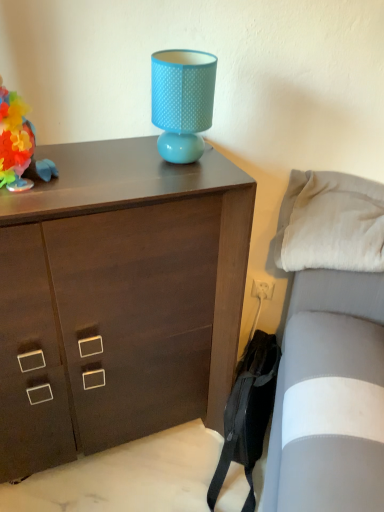
Where is `matte blue lampshade at upper center`? This screenshot has width=384, height=512. matte blue lampshade at upper center is located at coordinates (182, 101).

What are the coordinates of `multicolored paper flower at left` in the screenshot? It's located at (19, 144).

What do you see at coordinates (19, 144) in the screenshot? I see `multicolored paper flower at left` at bounding box center [19, 144].

This screenshot has height=512, width=384. Find the location of `matte blue lampshade at upper center`. matte blue lampshade at upper center is located at coordinates (182, 101).

Locate an element on the screen. The height and width of the screenshot is (512, 384). table lamp in front of the white soft pillow at right is located at coordinates (182, 101).

From a real-world perspective, is matte blue lampshade at upper center positioned above or below white soft pillow at right?

In terms of real-world spatial position, matte blue lampshade at upper center is above white soft pillow at right.

Is matte blue lampshade at upper center behind white soft pillow at right?

That is False.

Considering the positions of objects matte blue lampshade at upper center and white soft pillow at right in the image provided, who is more to the left, matte blue lampshade at upper center or white soft pillow at right?

From the viewer's perspective, matte blue lampshade at upper center appears more on the left side.

Is matte blue lampshade at upper center far away from dark wood chest of drawers at upper center?

Actually, matte blue lampshade at upper center and dark wood chest of drawers at upper center are a little close together.

How many degrees apart are the facing directions of matte blue lampshade at upper center and dark wood chest of drawers at upper center?

The angle between the facing direction of matte blue lampshade at upper center and the facing direction of dark wood chest of drawers at upper center is 2.59 degrees.

Identify the location of table lamp located above the dark wood chest of drawers at upper center (from the image's perspective). (182, 101).

Is matte blue lampshade at upper center taller or shorter than dark wood chest of drawers at upper center?

matte blue lampshade at upper center is shorter than dark wood chest of drawers at upper center.

Is dark wood chest of drawers at upper center facing away from multicolored paper flower at left?

That's not correct — dark wood chest of drawers at upper center is not looking away from multicolored paper flower at left.

From the image's perspective, is dark wood chest of drawers at upper center located above or below multicolored paper flower at left?

dark wood chest of drawers at upper center is below multicolored paper flower at left.

From the picture: How distant is dark wood chest of drawers at upper center from multicolored paper flower at left?

44.23 centimeters.

Considering the sizes of objects dark wood chest of drawers at upper center and multicolored paper flower at left in the image provided, who is wider, dark wood chest of drawers at upper center or multicolored paper flower at left?

dark wood chest of drawers at upper center.

Which object is closer to the camera taking this photo, white soft pillow at right or multicolored paper flower at left?

multicolored paper flower at left is more forward.

From a real-world perspective, is white soft pillow at right on multicolored paper flower at left?

No, from a real-world perspective, white soft pillow at right is not over multicolored paper flower at left

Considering the positions of point (306, 203) and point (22, 185), is point (306, 203) closer or farther from the camera than point (22, 185)?

Point (306, 203) is farther from the camera than point (22, 185).

I want to click on toy in front of the white soft pillow at right, so point(19,144).

Who is smaller, white soft pillow at right or matte blue lampshade at upper center?

→ matte blue lampshade at upper center is smaller.

Is white soft pillow at right oriented away from matte blue lampshade at upper center?

No, matte blue lampshade at upper center is not at the back of white soft pillow at right.

Is white soft pillow at right far away from matte blue lampshade at upper center?

No, white soft pillow at right is not far from matte blue lampshade at upper center.

From the image's perspective, is multicolored paper flower at left on top of matte blue lampshade at upper center?

No, from the image's perspective, multicolored paper flower at left is not above matte blue lampshade at upper center.

Is there a large distance between multicolored paper flower at left and matte blue lampshade at upper center?

No, multicolored paper flower at left is in close proximity to matte blue lampshade at upper center.

From a real-world perspective, is multicolored paper flower at left located higher than matte blue lampshade at upper center?

Correct, in the physical world, multicolored paper flower at left is higher than matte blue lampshade at upper center.

Locate an element on the screen. table lamp on the right side of multicolored paper flower at left is located at coordinates (182, 101).

Between dark wood chest of drawers at upper center and white soft pillow at right, which one appears on the right side from the viewer's perspective?

From the viewer's perspective, white soft pillow at right appears more on the right side.

From the image's perspective, is dark wood chest of drawers at upper center above white soft pillow at right?

Actually, dark wood chest of drawers at upper center appears below white soft pillow at right in the image.

Looking at their sizes, would you say dark wood chest of drawers at upper center is wider or thinner than white soft pillow at right?

Clearly, dark wood chest of drawers at upper center has more width compared to white soft pillow at right.

At what (x,y) coordinates should I click in order to perform the action: click on table lamp lying on the left of white soft pillow at right. Please return your answer as a coordinate pair (x, y). Looking at the image, I should click on (182, 101).

Identify the location of table lamp above the dark wood chest of drawers at upper center (from the image's perspective). (182, 101).

Considering their positions, is multicolored paper flower at left positioned further to matte blue lampshade at upper center than white soft pillow at right?

white soft pillow at right is further to matte blue lampshade at upper center.

Considering their positions, is multicolored paper flower at left positioned further to white soft pillow at right than dark wood chest of drawers at upper center?

multicolored paper flower at left is further to white soft pillow at right.

Considering their positions, is dark wood chest of drawers at upper center positioned closer to matte blue lampshade at upper center than multicolored paper flower at left?

The object closer to matte blue lampshade at upper center is multicolored paper flower at left.

Estimate the real-world distances between objects in this image. Which object is closer to dark wood chest of drawers at upper center, matte blue lampshade at upper center or multicolored paper flower at left?

matte blue lampshade at upper center lies closer to dark wood chest of drawers at upper center than the other object.

Estimate the real-world distances between objects in this image. Which object is further from white soft pillow at right, dark wood chest of drawers at upper center or matte blue lampshade at upper center?

dark wood chest of drawers at upper center is further to white soft pillow at right.

From the picture: Which object lies further to the anchor point multicolored paper flower at left, dark wood chest of drawers at upper center or white soft pillow at right?

The object further to multicolored paper flower at left is white soft pillow at right.

Estimate the real-world distances between objects in this image. Which object is further from multicolored paper flower at left, white soft pillow at right or matte blue lampshade at upper center?

white soft pillow at right lies further to multicolored paper flower at left than the other object.

Looking at the image, which one is located further to dark wood chest of drawers at upper center, multicolored paper flower at left or matte blue lampshade at upper center?

multicolored paper flower at left.

Locate an element on the screen. The width and height of the screenshot is (384, 512). toy between matte blue lampshade at upper center and dark wood chest of drawers at upper center from top to bottom is located at coordinates pos(19,144).

You are a GUI agent. You are given a task and a screenshot of the screen. Output one action in this format:
    pyautogui.click(x=<x>, y=<y>)
    Task: Click on the table lamp between dark wood chest of drawers at upper center and white soft pillow at right from left to right
    
    Given the screenshot: What is the action you would take?
    pyautogui.click(x=182, y=101)

Identify the location of chest of drawers between multicolored paper flower at left and white soft pillow at right from left to right. (120, 297).

The width and height of the screenshot is (384, 512). Identify the location of table lamp between multicolored paper flower at left and white soft pillow at right in the horizontal direction. (182, 101).